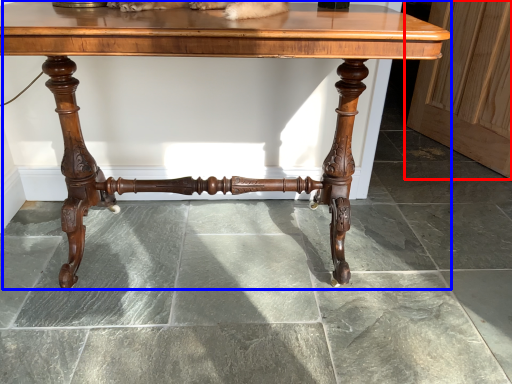
Question: Which object is further to the camera taking this photo, screen door (highlighted by a red box) or table (highlighted by a blue box)?

Choices:
 (A) screen door
 (B) table

Answer: (A)